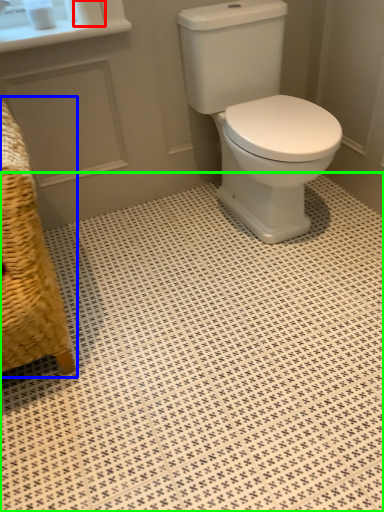
Question: Which object is the farthest from toilet paper (highlighted by a red box)? Choose among these: armchair (highlighted by a blue box) or ceramic tile (highlighted by a green box).

Choices:
 (A) armchair
 (B) ceramic tile

Answer: (B)